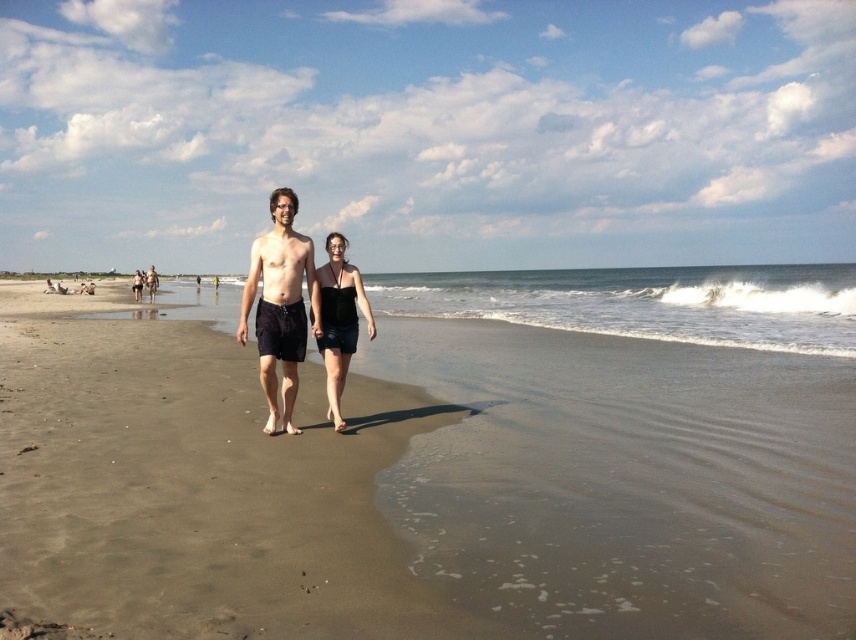
You are a photographer standing on the beach. You want to take a photo of the smooth sand at center and the matte black shorts at center. Based on their positions, which object is located lower in the image?

The smooth sand at center is located lower in the image than the matte black shorts at center because the smooth sand at center is below matte black shorts at center.